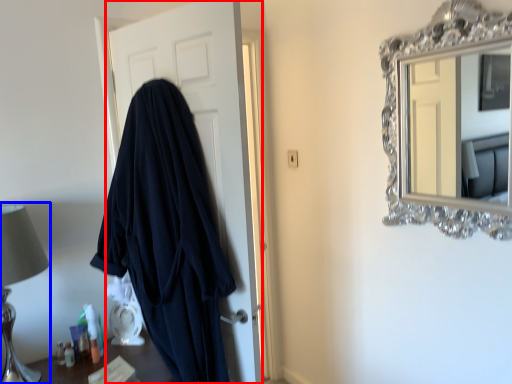
Question: Which point is further to the camera, door (highlighted by a red box) or table lamp (highlighted by a blue box)?

Choices:
 (A) door
 (B) table lamp

Answer: (B)